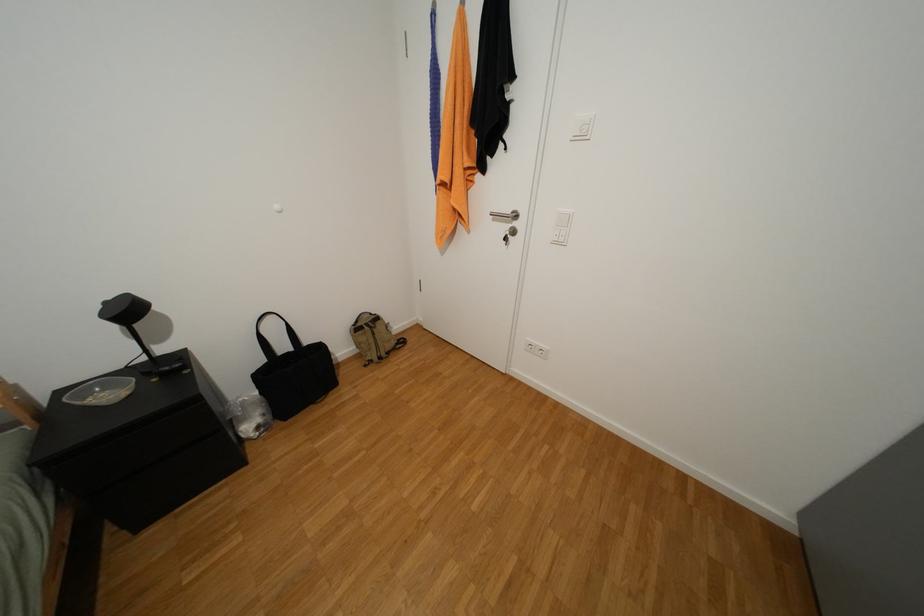
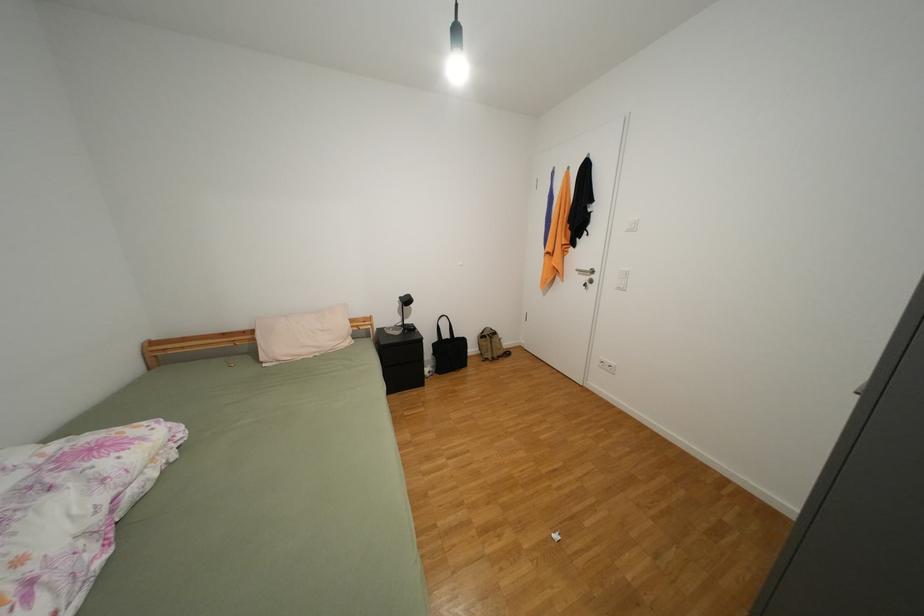
Question: Based on the continuous images, in which direction is the camera rotating? Reply with the corresponding letter.

Choices:
 (A) Left
 (B) Right
 (C) Up
 (D) Down

Answer: (A)